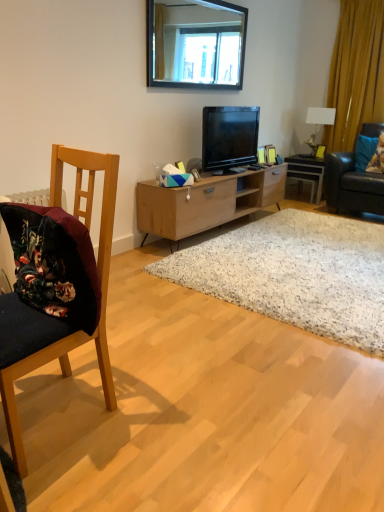
Find the location of a particular element. This screenshot has width=384, height=512. vacant area that is situated to the right of velvet dark blue chair at left is located at coordinates (163, 415).